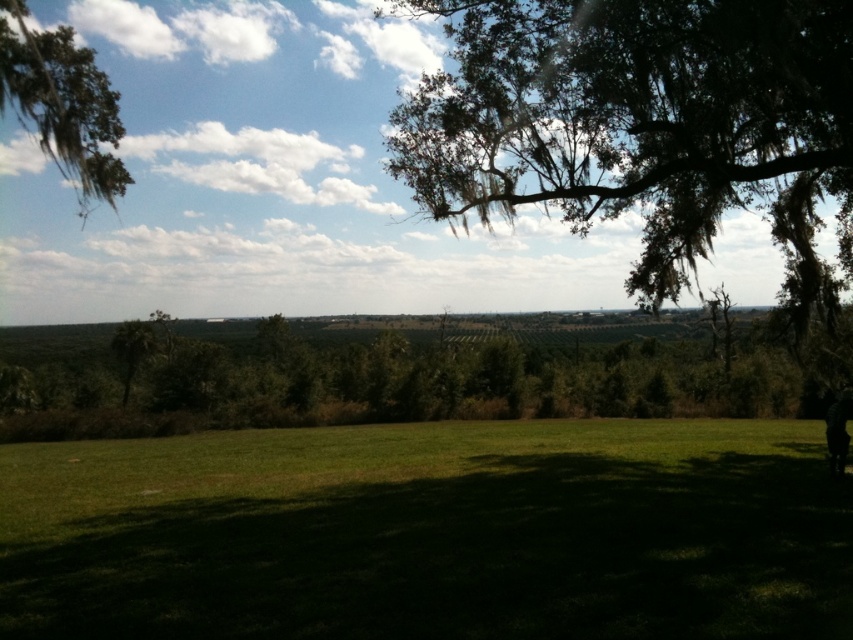
You are standing in the middle of the green grass at lower center and want to reach the green mossy branch at upper left. Which direction should you move to get closer to the branch?

To reach the green mossy branch at upper left from the green grass at lower center, you should move upward since the branch is positioned above the grass.